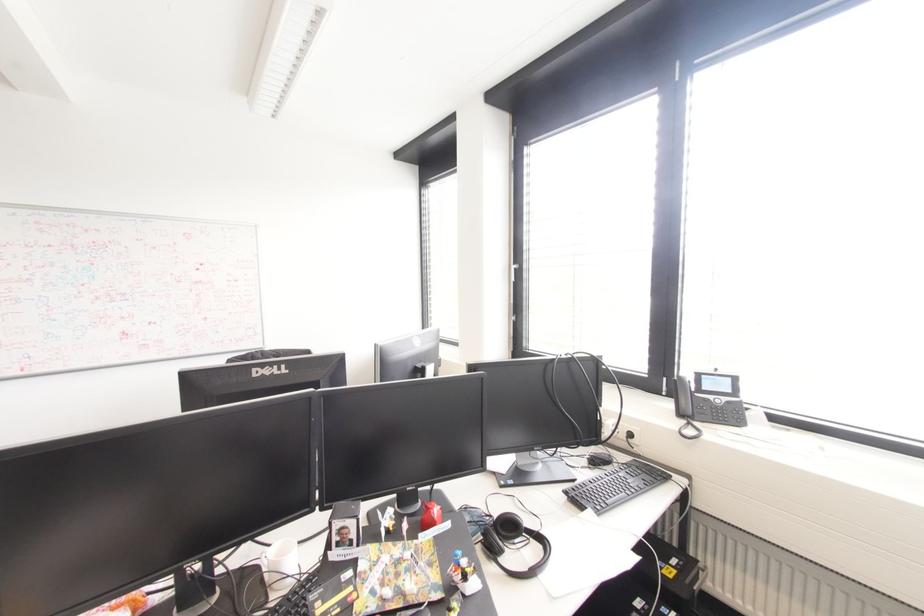
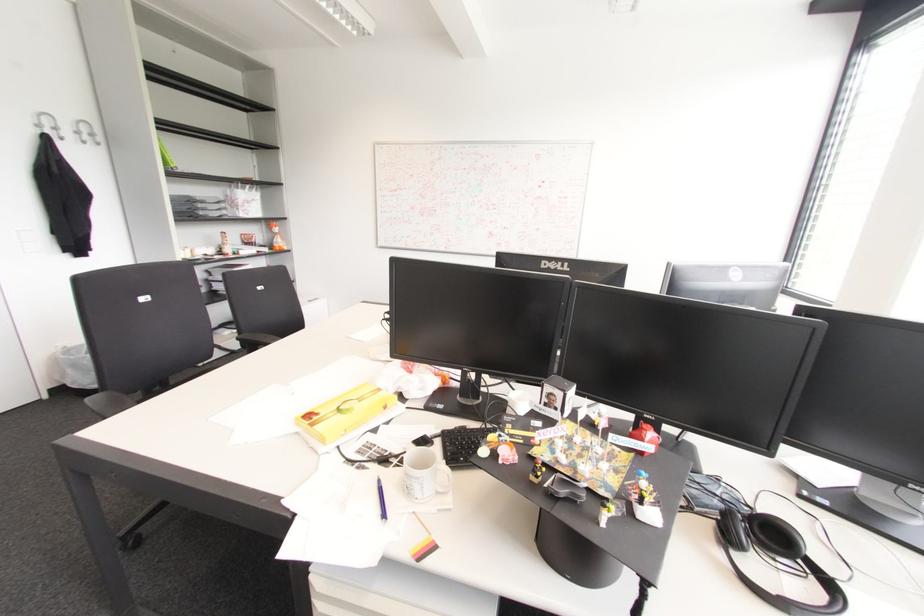
Question: The first image is from the beginning of the video and the second image is from the end. How did the camera likely rotate when shooting the video?

Choices:
 (A) Left
 (B) Right
 (C) Up
 (D) Down

Answer: (A)